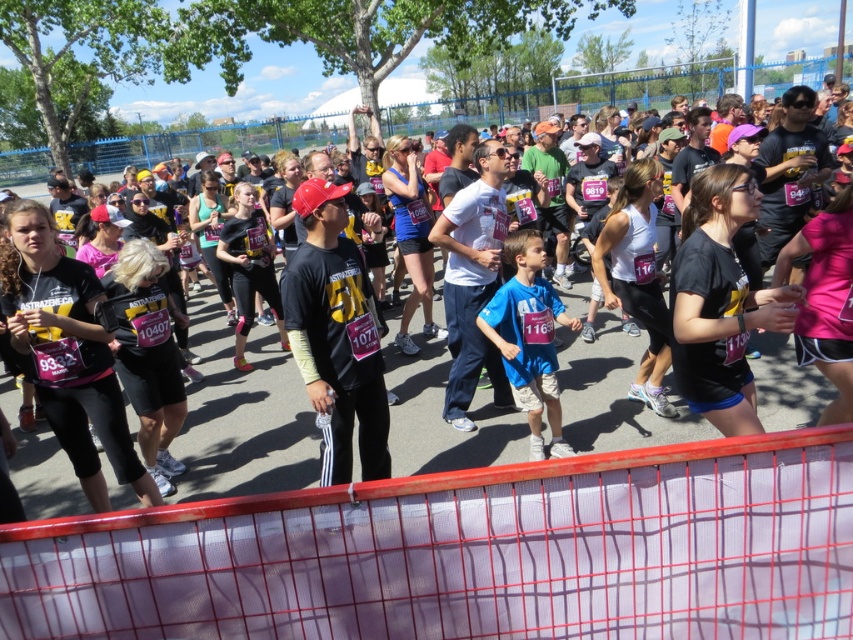
Is black t-shirt at center positioned behind black matte shirt at left?

Yes, it is.

From the picture: Which is more to the left, black t-shirt at center or black matte shirt at left?

From the viewer's perspective, black matte shirt at left appears more on the left side.

Image resolution: width=853 pixels, height=640 pixels. What are the coordinates of `black t-shirt at center` in the screenshot? It's located at (244, 420).